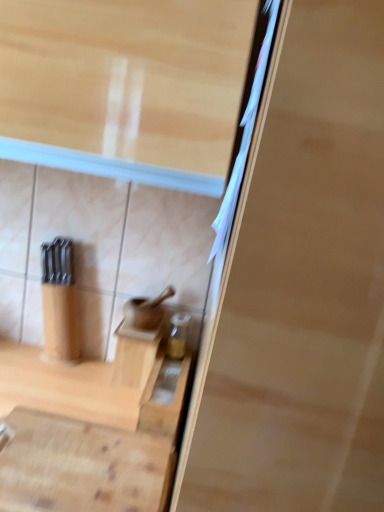
Question: Looking at the image, does wooden cabinet at center, the second cabinetry when ordered from front to back, seem bigger or smaller compared to wooden cutting board at lower center, the second cabinetry viewed from the back?

Choices:
 (A) small
 (B) big

Answer: (A)

Question: Does point (122, 346) appear closer or farther from the camera than point (72, 437)?

Choices:
 (A) farther
 (B) closer

Answer: (A)

Question: Considering the positions of wooden cabinet at center, the second cabinetry when ordered from front to back, and wooden cutting board at lower center, the first cabinetry in the front-to-back sequence, in the image, is wooden cabinet at center, the second cabinetry when ordered from front to back, wider or thinner than wooden cutting board at lower center, the first cabinetry in the front-to-back sequence,?

Choices:
 (A) wide
 (B) thin

Answer: (B)

Question: From a real-world perspective, is wooden cutting board at lower center, the first cabinetry in the front-to-back sequence, physically located above or below wooden cabinet at center, acting as the 1th cabinetry starting from the back?

Choices:
 (A) above
 (B) below

Answer: (B)

Question: Is wooden cutting board at lower center, the second cabinetry viewed from the back, spatially inside wooden cabinet at center, the second cabinetry when ordered from front to back, or outside of it?

Choices:
 (A) outside
 (B) inside

Answer: (A)

Question: Looking at the image, does wooden cutting board at lower center, the first cabinetry in the front-to-back sequence, seem bigger or smaller compared to wooden cabinet at center, acting as the 1th cabinetry starting from the back?

Choices:
 (A) small
 (B) big

Answer: (B)

Question: Is wooden cutting board at lower center, the second cabinetry viewed from the back, in front of or behind wooden cabinet at center, acting as the 1th cabinetry starting from the back, in the image?

Choices:
 (A) behind
 (B) front

Answer: (B)